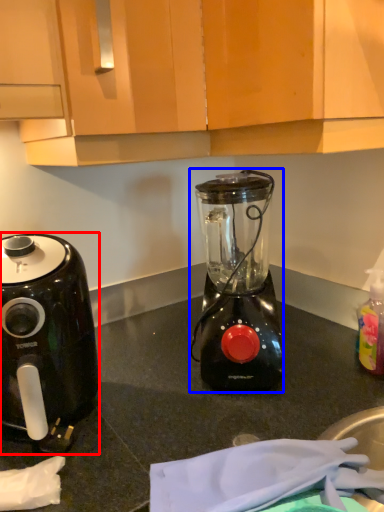
Question: Among these objects, which one is nearest to the camera, coffee maker (highlighted by a red box) or blender (highlighted by a blue box)?

Choices:
 (A) coffee maker
 (B) blender

Answer: (A)